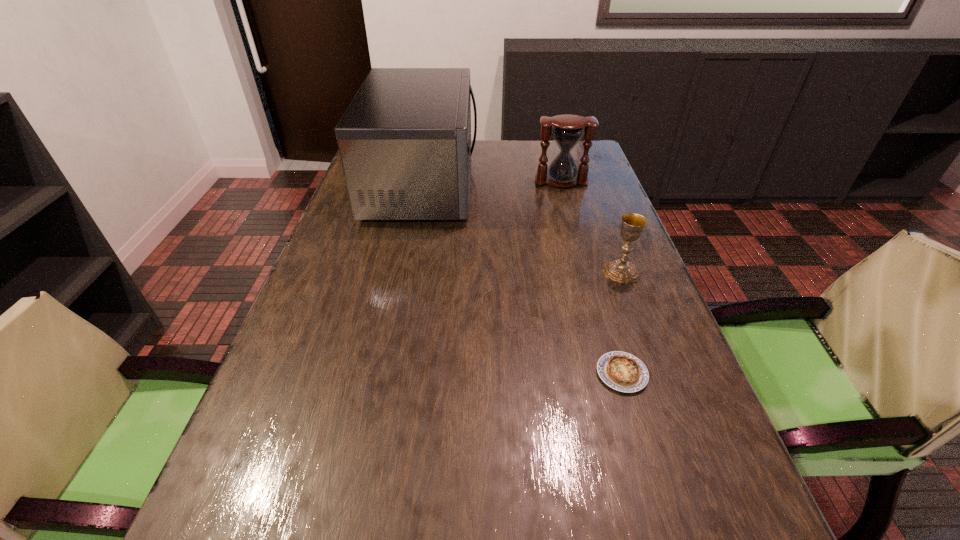
Locate an element on the screen. The width and height of the screenshot is (960, 540). the tallest object is located at coordinates (405, 139).

Locate an element on the screen. Image resolution: width=960 pixels, height=540 pixels. the leftmost object is located at coordinates (405, 139).

The width and height of the screenshot is (960, 540). Find the location of `hourglass`. hourglass is located at coordinates (567, 130).

This screenshot has width=960, height=540. I want to click on chalice, so click(x=622, y=271).

Locate an element on the screen. the third farthest object is located at coordinates (622, 271).

Locate an element on the screen. The height and width of the screenshot is (540, 960). the nearest object is located at coordinates (624, 372).

Image resolution: width=960 pixels, height=540 pixels. Identify the location of quiche. (624, 372).

You are a GUI agent. You are given a task and a screenshot of the screen. Output one action in this format:
    pyautogui.click(x=<x>, y=<y>)
    Task: Click on the vacant space situated 0.310m on the front-facing side of the tallest object
    This screenshot has height=540, width=960.
    Given the screenshot: What is the action you would take?
    pyautogui.click(x=574, y=184)

This screenshot has height=540, width=960. I want to click on vacant space located 0.300m on the left of the second tallest object, so click(442, 181).

In order to click on free spot located on the front of the chalice in this screenshot , I will do `click(636, 311)`.